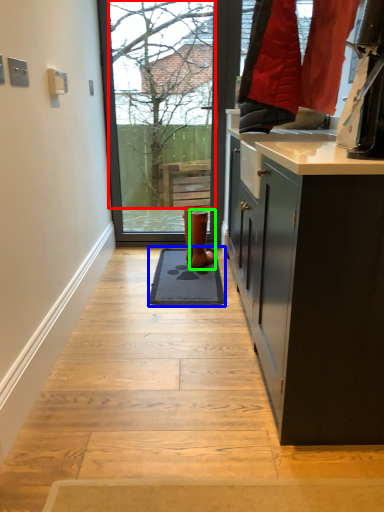
Question: Estimate the real-world distances between objects in this image. Which object is closer to tree (highlighted by a red box), doormat (highlighted by a blue box) or footwear (highlighted by a green box)?

Choices:
 (A) doormat
 (B) footwear

Answer: (B)